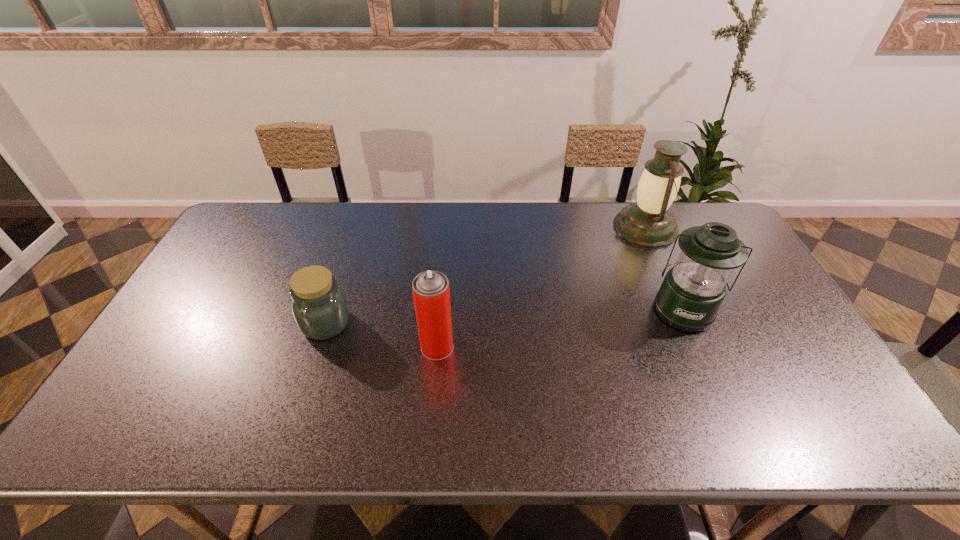
The image size is (960, 540). What are the coordinates of `vacant area that lies between the jar and the farthest object` in the screenshot? It's located at (486, 275).

The width and height of the screenshot is (960, 540). I want to click on vacant area that lies between the nearer lantern and the aerosol can, so click(x=561, y=328).

Locate an element on the screen. free space that is in between the jar and the second object from left to right is located at coordinates (381, 335).

Find the location of a particular element. free space between the farther lantern and the leftmost object is located at coordinates (486, 275).

Locate an element on the screen. free space that is in between the farthest object and the nearer lantern is located at coordinates (664, 268).

You are a GUI agent. You are given a task and a screenshot of the screen. Output one action in this format:
    pyautogui.click(x=<x>, y=<y>)
    Task: Click on the unoccupied position between the nearer lantern and the third object from right to left
    Image resolution: width=960 pixels, height=540 pixels.
    Given the screenshot: What is the action you would take?
    pyautogui.click(x=561, y=328)

Identify the location of vacant space that is in between the shortest object and the aerosol can. (381, 335).

Locate an element on the screen. This screenshot has width=960, height=540. unoccupied position between the third object from right to left and the farthest object is located at coordinates (541, 287).

At what (x,y) coordinates should I click in order to perform the action: click on the third closest object to the farthest object. Please return your answer as a coordinate pair (x, y). Looking at the image, I should click on (319, 306).

Locate an element on the screen. object that stands as the closest to the shortest object is located at coordinates (431, 293).